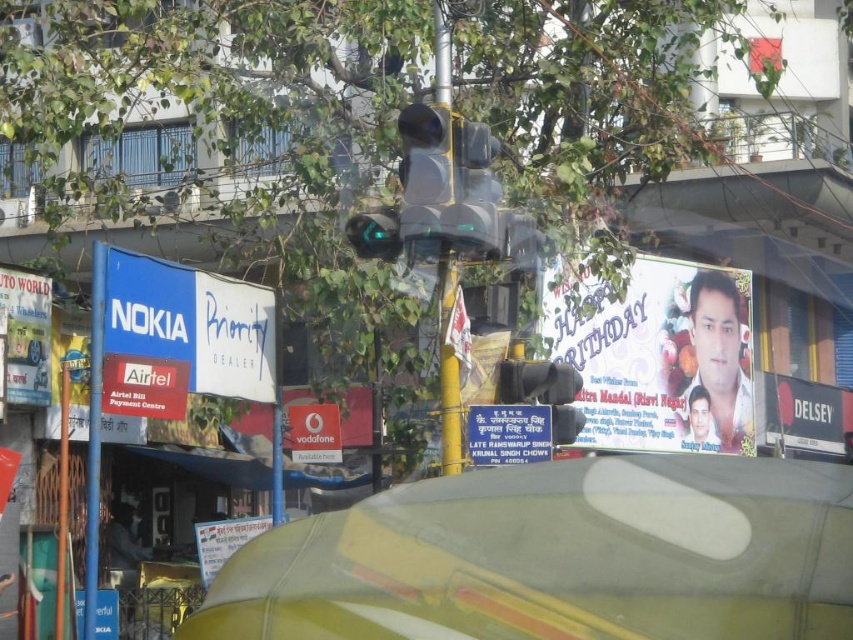
You are a pedestrian standing at the intersection and want to know which object is taller between the red glossy signboard at center and the green glass traffic light at upper center. Can you tell me?

The red glossy signboard at center is taller than the green glass traffic light at upper center according to the description.

You are standing in the middle of the street looking at the scene. Which of the two points, point (730, 314) or point (47, 336), is closer to you?

Point (47, 336) is closer to you because it is less further to the viewer than point (730, 314).

You are a delivery person trying to navigate through the street. You see the matte paper billboard at upper right and the metallic signboard at left. Which one is wider from your perspective?

The matte paper billboard at upper right might be wider than metallic signboard at left.